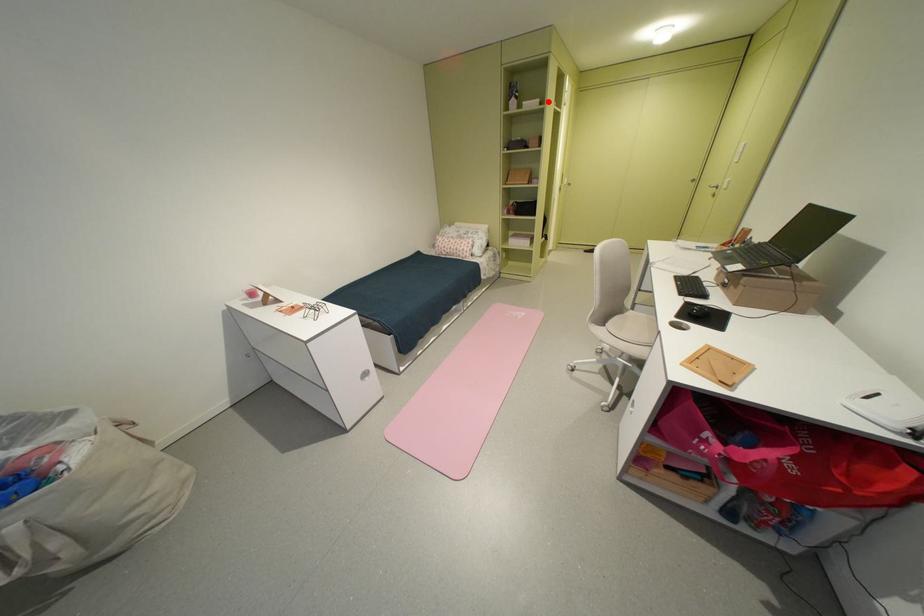
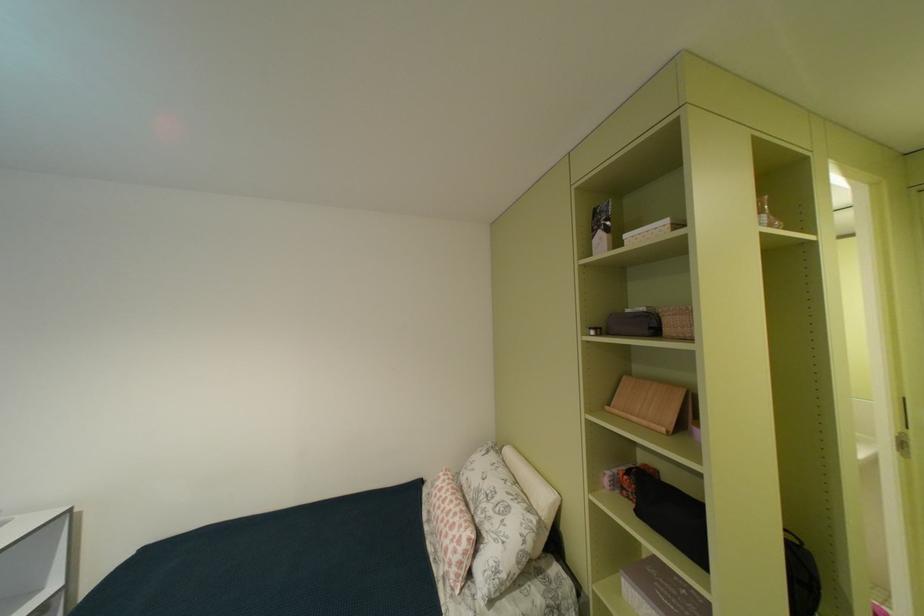
The point at the highlighted location is marked in the first image. Where is the corresponding point in the second image?

(676, 223)